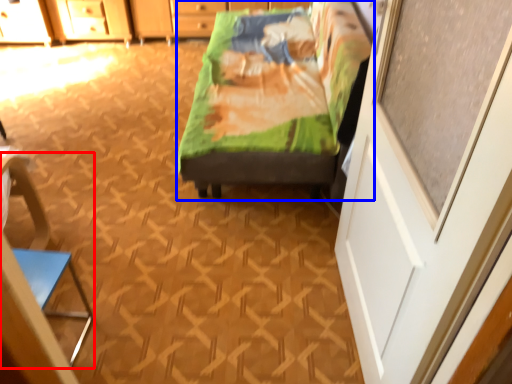
Question: Which point is closer to the camera, armchair (highlighted by a red box) or furniture (highlighted by a blue box)?

Choices:
 (A) armchair
 (B) furniture

Answer: (A)